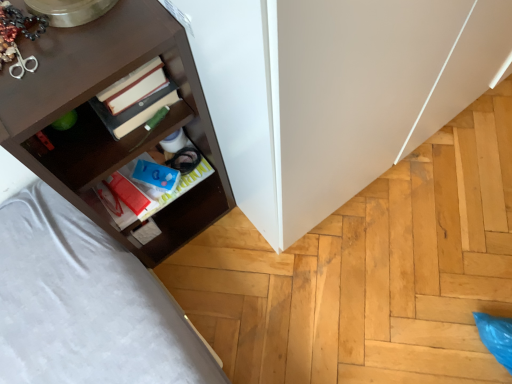
Question: Considering the positions of dark brown wood shelf at left and matte blue book at center in the image, is dark brown wood shelf at left bigger or smaller than matte blue book at center?

Choices:
 (A) big
 (B) small

Answer: (A)

Question: Do you think dark brown wood shelf at left is within matte blue book at center, or outside of it?

Choices:
 (A) outside
 (B) inside

Answer: (A)

Question: From the image's perspective, is dark brown wood shelf at left positioned above or below matte blue book at center?

Choices:
 (A) below
 (B) above

Answer: (B)

Question: Would you say matte blue book at center is to the left or to the right of dark brown wood shelf at left in the picture?

Choices:
 (A) right
 (B) left

Answer: (A)

Question: Is matte blue book at center in front of or behind dark brown wood shelf at left in the image?

Choices:
 (A) front
 (B) behind

Answer: (B)

Question: From a real-world perspective, is matte blue book at center positioned above or below dark brown wood shelf at left?

Choices:
 (A) above
 (B) below

Answer: (B)

Question: Is matte blue book at center spatially inside dark brown wood shelf at left, or outside of it?

Choices:
 (A) outside
 (B) inside

Answer: (B)